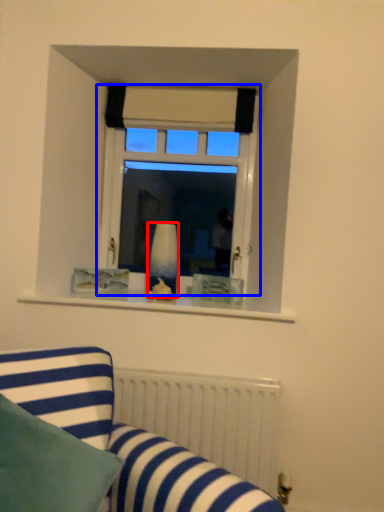
Question: Among these objects, which one is nearest to the camera, vase (highlighted by a red box) or window (highlighted by a blue box)?

Choices:
 (A) vase
 (B) window

Answer: (A)